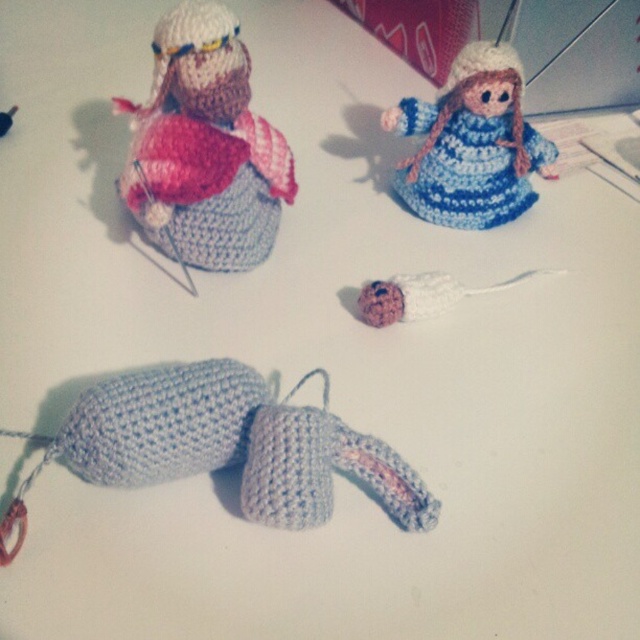
You are an artist planning to paint a scene based on the image. You need to place a small golden star sticker exactly at the point with coordinates point (225, 445). According to the scene description, which object will the sticker be placed on?

The point (225, 445) corresponds to the light blue yarn toy at center, so the sticker will be placed on the light blue yarn toy at center.

You are holding a camera and want to take a closeup photo of the blue yarn doll at upper center. The camera requires at least 1 meter of space to focus properly. Is the current distance sufficient?

The distance between the blue yarn doll at upper center and the camera is 1.28 meters, which is more than the required 1 meter, so the camera can focus properly.

You are organizing a display of crocheted items and need to place a new item between the crocheted dog lying down and the blue yarn doll at upper center. Based on their positions, which item is closer to the center of the display area?

The blue yarn doll at upper center is closer to the center of the display area because its coordinates are closer to the center point compared to the crocheted dog lying down.